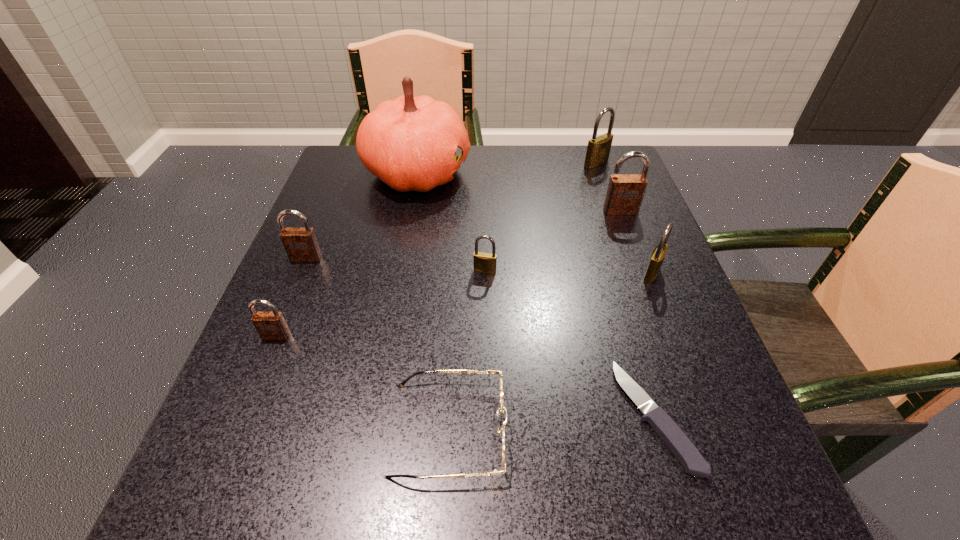
At what (x,y) coordinates should I click in order to perform the action: click on the third padlock from left to right. Please return your answer as a coordinate pair (x, y). The image size is (960, 540). Looking at the image, I should click on (485, 263).

Where is `the smallest brown padlock`? Image resolution: width=960 pixels, height=540 pixels. the smallest brown padlock is located at coordinates (270, 325).

The height and width of the screenshot is (540, 960). I want to click on the nearest padlock, so click(270, 325).

The height and width of the screenshot is (540, 960). In order to click on green spectacles in this screenshot , I will do `click(503, 409)`.

Where is `the second shortest object`? the second shortest object is located at coordinates (503, 409).

Locate an element on the screen. Image resolution: width=960 pixels, height=540 pixels. steak knife is located at coordinates (679, 444).

You are a GUI agent. You are given a task and a screenshot of the screen. Output one action in this format:
    pyautogui.click(x=<x>, y=<y>)
    Task: Click on the vacant space located on the front-facing side of the tallest object
    
    Given the screenshot: What is the action you would take?
    pyautogui.click(x=589, y=172)

Where is `free space located on the left of the farthest padlock`? free space located on the left of the farthest padlock is located at coordinates (429, 163).

What are the coordinates of `free space located on the front-facing side of the farthest brown padlock` in the screenshot? It's located at (665, 332).

I want to click on vacant space located on the left of the second smallest brass padlock, so click(594, 274).